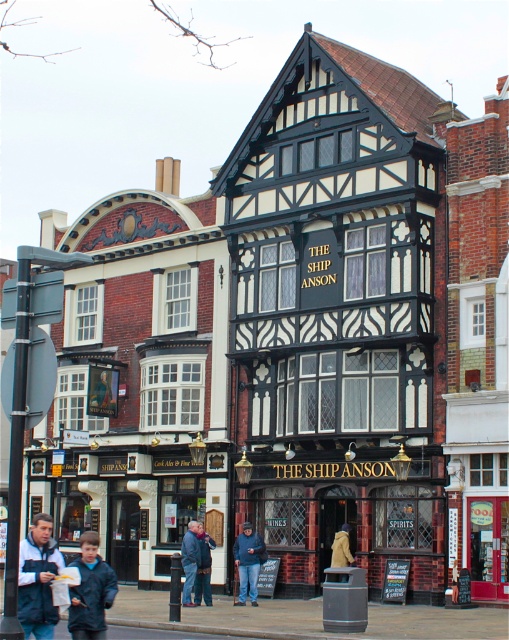
Does blue fleece jacket at lower left come in front of blue denim jeans at lower center?

Yes, blue fleece jacket at lower left is closer to the viewer.

Measure the distance between blue fleece jacket at lower left and camera.

110.36 feet

The height and width of the screenshot is (640, 509). Describe the element at coordinates (38, 579) in the screenshot. I see `blue fleece jacket at lower left` at that location.

This screenshot has height=640, width=509. What are the coordinates of `blue fleece jacket at lower left` in the screenshot? It's located at (38, 579).

Does matte black pub at center have a lesser width compared to blue denim jeans at lower center?

In fact, matte black pub at center might be wider than blue denim jeans at lower center.

Describe the element at coordinates (346, 522) in the screenshot. I see `matte black pub at center` at that location.

Image resolution: width=509 pixels, height=640 pixels. In order to click on matte black pub at center in this screenshot , I will do `click(346, 522)`.

Can you confirm if dark blue jacket at lower left is taller than dark blue jeans at center?

Yes.

Image resolution: width=509 pixels, height=640 pixels. Identify the location of dark blue jacket at lower left. (91, 592).